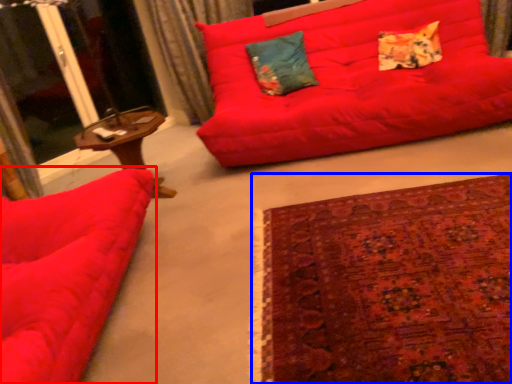
Question: Which point is closer to the camera, studio couch (highlighted by a red box) or plain (highlighted by a blue box)?

Choices:
 (A) studio couch
 (B) plain

Answer: (A)